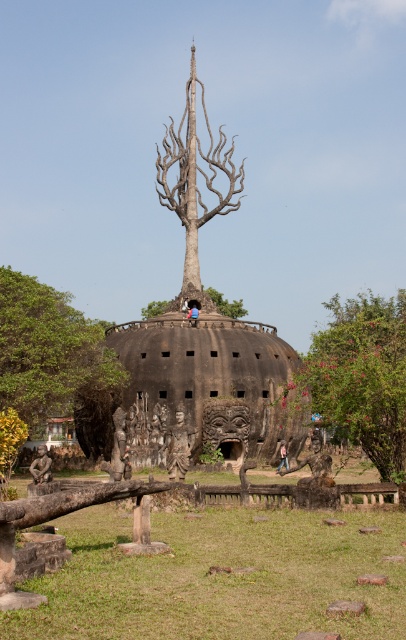
Can you confirm if green leafy tree at lower right is shorter than green leafy tree at left?

Yes, green leafy tree at lower right is shorter than green leafy tree at left.

Who is taller, green leafy tree at lower right or green leafy tree at left?

green leafy tree at left

You are a GUI agent. You are given a task and a screenshot of the screen. Output one action in this format:
    pyautogui.click(x=<x>, y=<y>)
    Task: Click on the green leafy tree at lower right
    The width and height of the screenshot is (406, 640).
    Given the screenshot: What is the action you would take?
    pyautogui.click(x=362, y=376)

Does wooden statue at center have a larger size compared to dark brown wooden statue at lower left?

No.

Describe the element at coordinates (179, 445) in the screenshot. I see `wooden statue at center` at that location.

Between point (183, 428) and point (43, 452), which one is positioned behind?

The point (43, 452) is more distant.

You are a GUI agent. You are given a task and a screenshot of the screen. Output one action in this format:
    pyautogui.click(x=<x>, y=<y>)
    Task: Click on the wooden statue at center
    The height and width of the screenshot is (640, 406).
    Given the screenshot: What is the action you would take?
    pyautogui.click(x=179, y=445)

Which is behind, point (222, 147) or point (51, 476)?

Point (222, 147)

Does point (164, 202) come closer to viewer compared to point (49, 472)?

No, (164, 202) is further to viewer.

Who is more distant from viewer, (190,109) or (47,451)?

Positioned behind is point (190,109).

You are a GUI agent. You are given a task and a screenshot of the screen. Output one action in this format:
    pyautogui.click(x=<x>, y=<y>)
    Task: Click on the brown/dead wood tree at center
    The width and height of the screenshot is (406, 640).
    Given the screenshot: What is the action you would take?
    pyautogui.click(x=196, y=180)